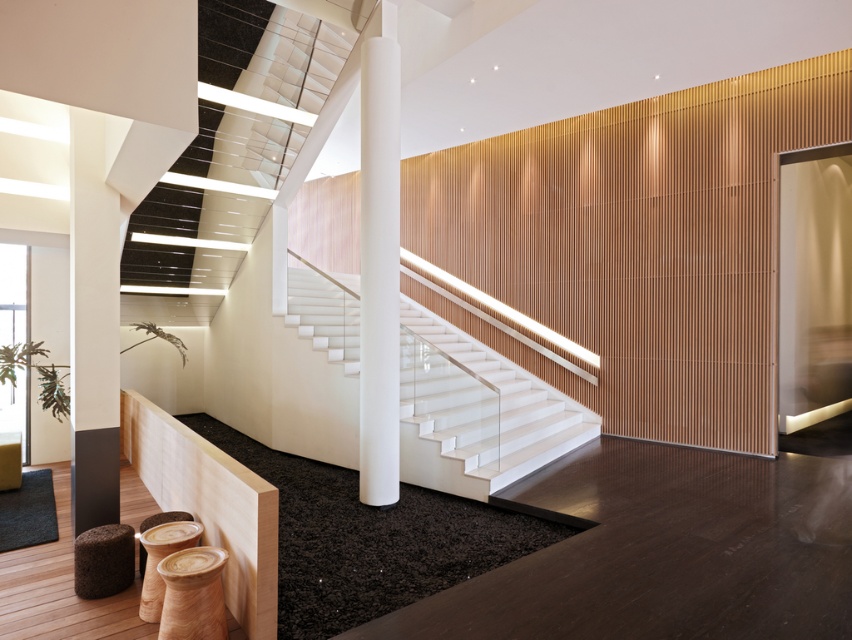
Is white glossy stairs at center thinner than wooden stool at lower left?

No, white glossy stairs at center is not thinner than wooden stool at lower left.

Is point (441, 332) farther from camera compared to point (163, 513)?

Yes.

Image resolution: width=852 pixels, height=640 pixels. Identify the location of white glossy stairs at center. (475, 412).

Between point (187, 513) and point (142, 520), which one is positioned in front?

Point (142, 520)

Can you confirm if wooden textured stool at lower left is thinner than wooden stool at lower left?

No.

Is point (170, 536) closer to viewer compared to point (154, 524)?

Yes, point (170, 536) is closer to viewer.

This screenshot has height=640, width=852. What are the coordinates of `wooden textured stool at lower left` in the screenshot? It's located at (160, 557).

What do you see at coordinates (91, 326) in the screenshot?
I see `white glossy column at left` at bounding box center [91, 326].

Between white glossy column at left and wooden textured stool at lower left, which one has less height?

wooden textured stool at lower left is shorter.

Locate an element on the screen. white glossy column at left is located at coordinates (91, 326).